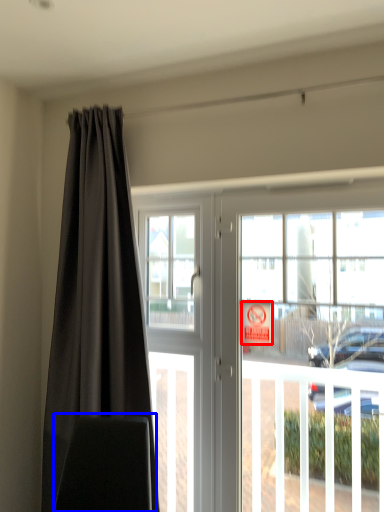
Question: Which object is closer to the camera taking this photo, parking sign (highlighted by a red box) or swivel chair (highlighted by a blue box)?

Choices:
 (A) parking sign
 (B) swivel chair

Answer: (B)